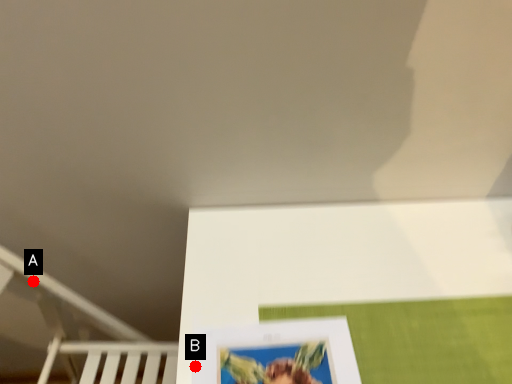
Question: Two points are circled on the image, labeled by A and B beside each circle. Which point is farther to the camera?

Choices:
 (A) A is further
 (B) B is further

Answer: (A)